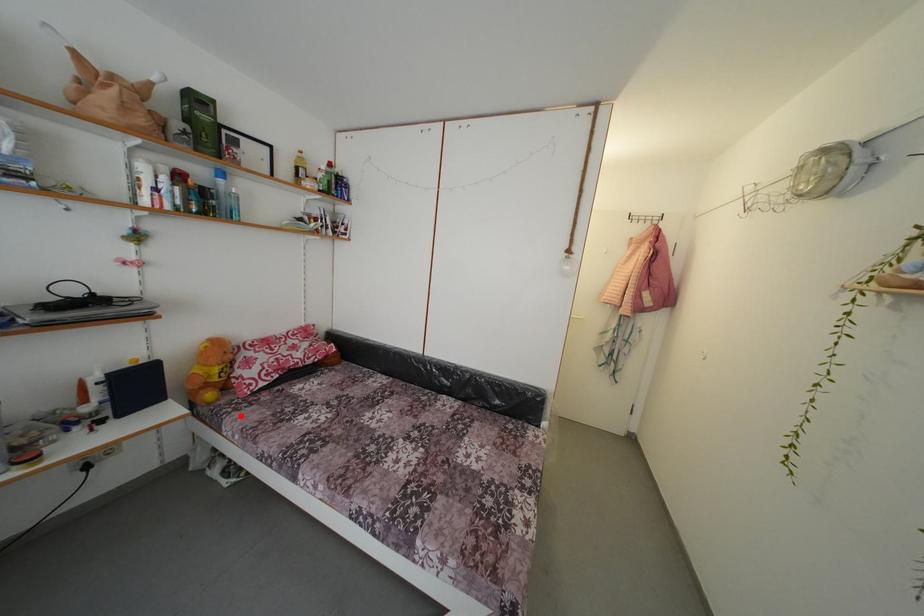
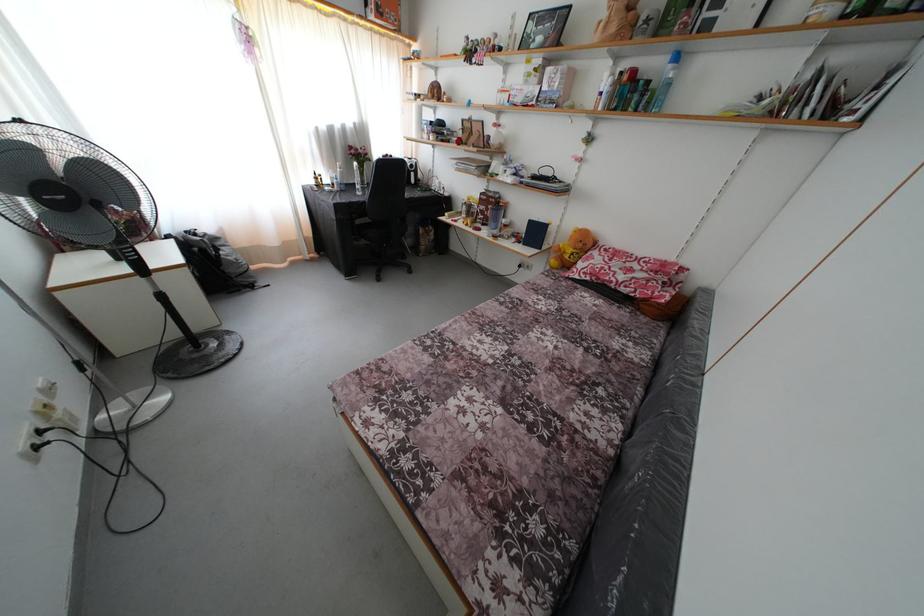
The point at the highlighted location is marked in the first image. Where is the corresponding point in the second image?

(552, 282)